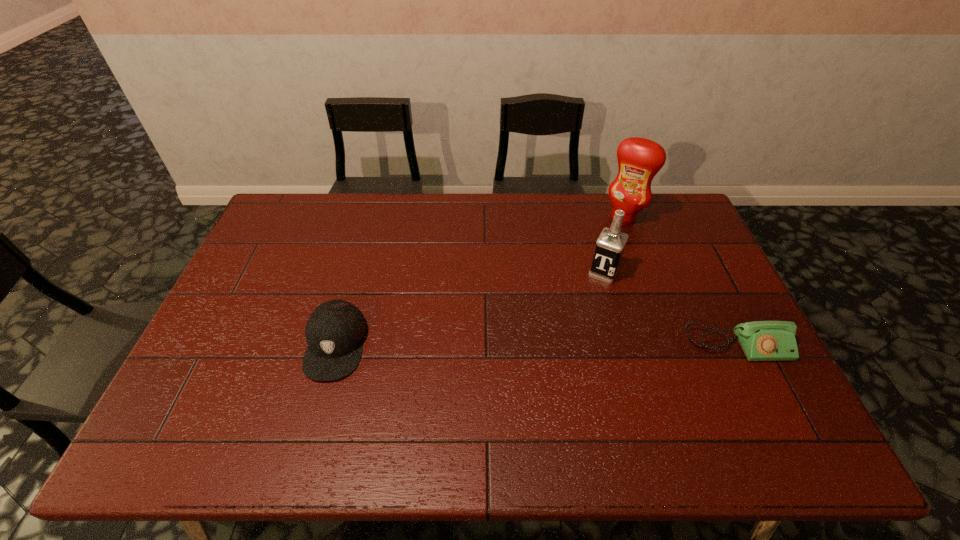
Find the location of `free space between the third object from right to left and the telephone`. free space between the third object from right to left and the telephone is located at coordinates (670, 309).

The height and width of the screenshot is (540, 960). What are the coordinates of `free space between the shortest object and the second shortest object` in the screenshot? It's located at (536, 345).

Locate which object is the second closest to the second shortest object. Please provide its 2D coordinates. Your answer should be formatted as a tuple, i.e. [(x, y)], where the tuple contains the x and y coordinates of a point satisfying the conditions above.

[(639, 159)]

The width and height of the screenshot is (960, 540). What are the coordinates of `object that is the third nearest to the shortest object` in the screenshot? It's located at coord(335,331).

Locate an element on the screen. This screenshot has width=960, height=540. vacant space that satisfies the following two spatial constraints: 1. on the back side of the tallest object; 2. on the left side of the second object from left to right is located at coordinates (588, 218).